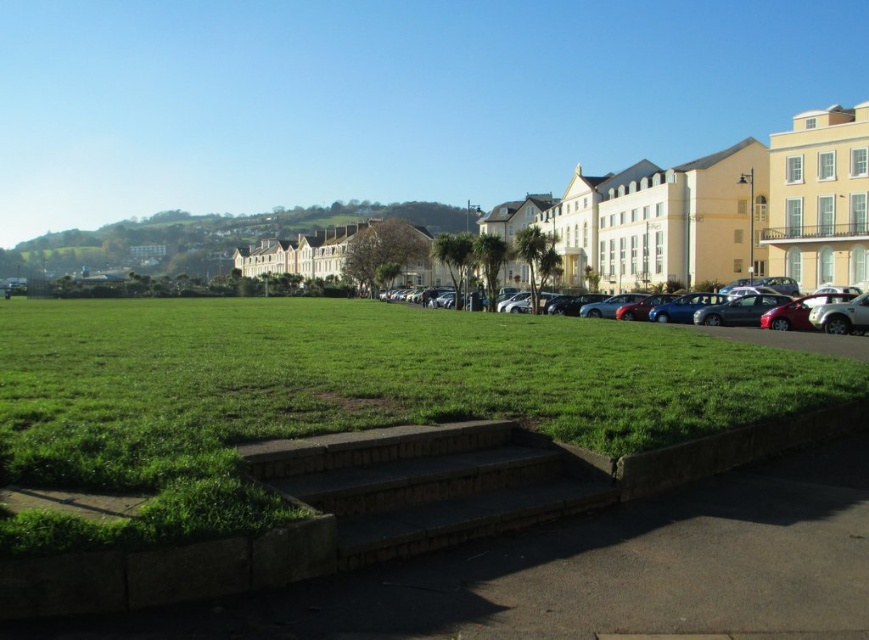
You are standing at the entrance of the park and want to reach the brown stone stairs at center. According to the coordinates provided, in which direction should you walk from your current position to reach them?

The brown stone stairs at center are located at coordinates point (430, 483). Since you are at the entrance, you should walk towards the center of the image to reach them.

You are standing at the point with coordinates point (764, 305) and want to walk towards the point with coordinates point (780, 358). According to the scene, which direction should you face to move towards the desired point?

Point (780, 358) is in front of point (764, 305), so you should face forward to move towards the desired point.

You are standing at the point with coordinates (430, 483) in the urban park scene. What object is located exactly at that point?

The brown stone stairs at center are located exactly at point (430, 483) in the urban park scene.